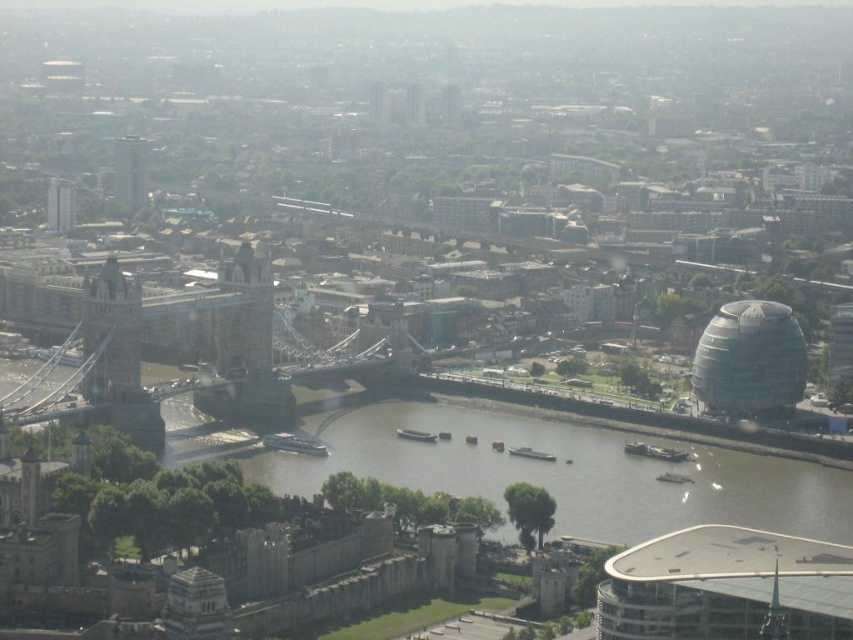
Based on the photo, can you confirm if stone bridge at center-left is taller than matte glass skyscraper at upper left?

Correct, stone bridge at center-left is much taller as matte glass skyscraper at upper left.

Is stone bridge at center-left thinner than matte glass skyscraper at upper left?

In fact, stone bridge at center-left might be wider than matte glass skyscraper at upper left.

Image resolution: width=853 pixels, height=640 pixels. I want to click on stone bridge at center-left, so click(245, 316).

The width and height of the screenshot is (853, 640). What are the coordinates of `stone bridge at center-left` in the screenshot? It's located at (245, 316).

Is point (584, 440) positioned behind point (122, 342)?

That is True.

Can you confirm if brown water at center is shorter than matte gray bridge at left?

Yes, brown water at center is shorter than matte gray bridge at left.

Who is more distant from viewer, (505, 484) or (134, 308)?

Point (134, 308)

Find the location of `brown water at center`. brown water at center is located at coordinates (541, 467).

Is point (769, 404) in front of point (90, 339)?

No, it is behind (90, 339).

Does white glass dome at right have a lesser width compared to matte gray bridge at left?

Incorrect, white glass dome at right's width is not less than matte gray bridge at left's.

Image resolution: width=853 pixels, height=640 pixels. I want to click on white glass dome at right, so click(749, 358).